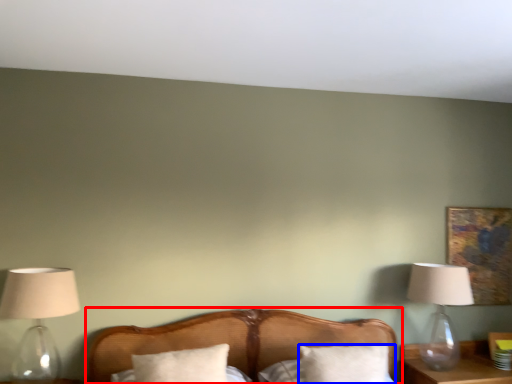
Question: Among these objects, which one is nearest to the camera, bed (highlighted by a red box) or pillow (highlighted by a blue box)?

Choices:
 (A) bed
 (B) pillow

Answer: (A)